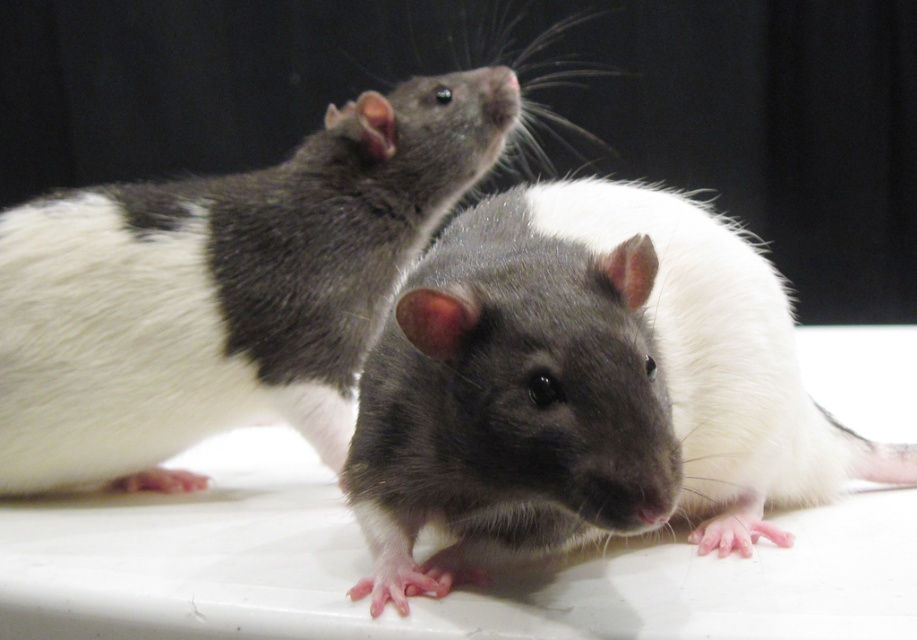
Can you confirm if shiny fur mouse at center is positioned to the right of shiny gray fur at center?

Incorrect, shiny fur mouse at center is not on the right side of shiny gray fur at center.

Who is taller, shiny fur mouse at center or shiny gray fur at center?

shiny fur mouse at center is taller.

Which is behind, point (376, 204) or point (744, 426)?

Positioned behind is point (376, 204).

I want to click on shiny fur mouse at center, so click(x=229, y=205).